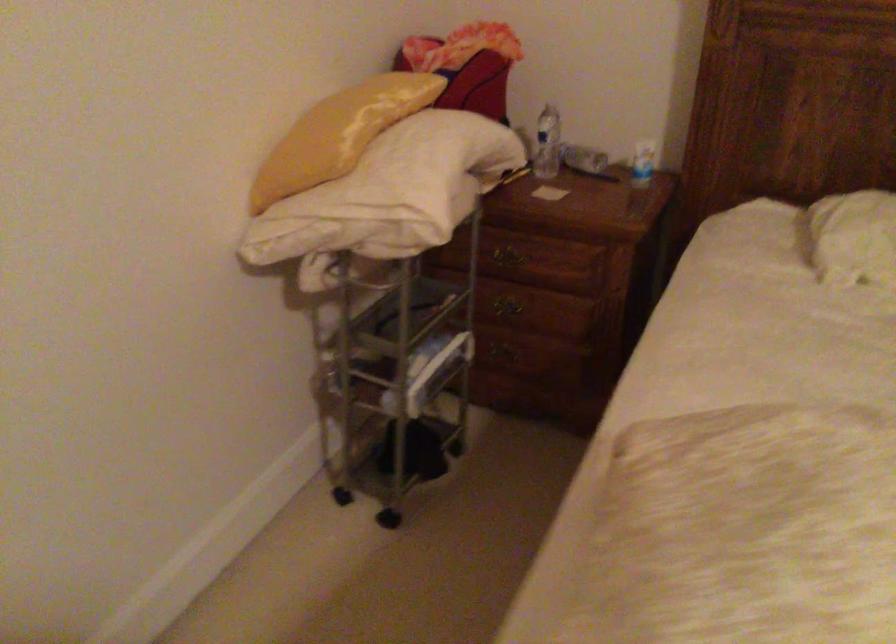
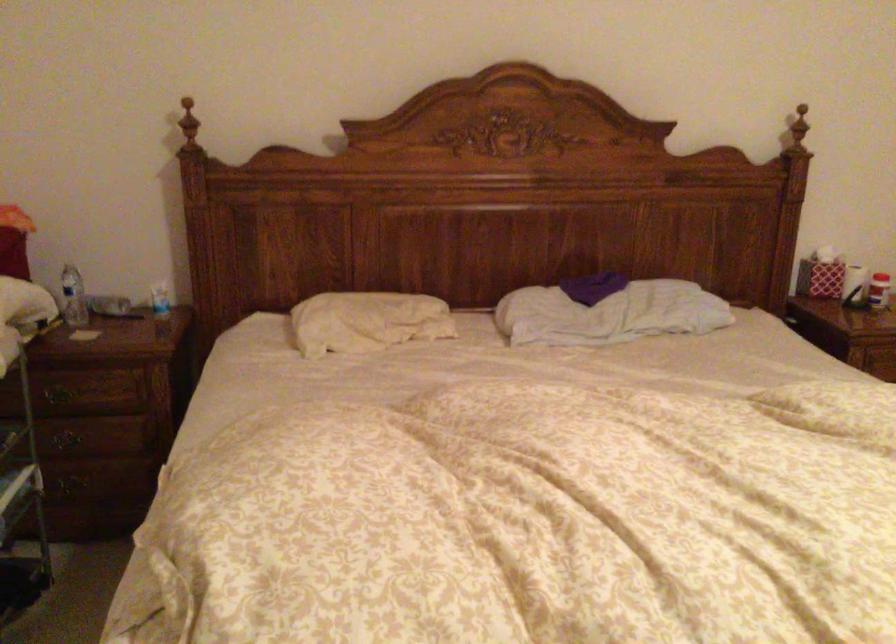
Question: The camera is either moving clockwise (left) or counter-clockwise (right) around the object. The first image is from the beginning of the video and the second image is from the end. Is the camera moving left or right when shooting the video?

Choices:
 (A) Left
 (B) Right

Answer: (A)